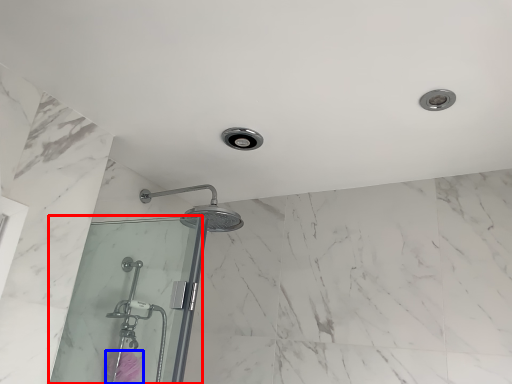
Question: Among these objects, which one is nearest to the camera, screen door (highlighted by a red box) or flower (highlighted by a blue box)?

Choices:
 (A) screen door
 (B) flower

Answer: (A)